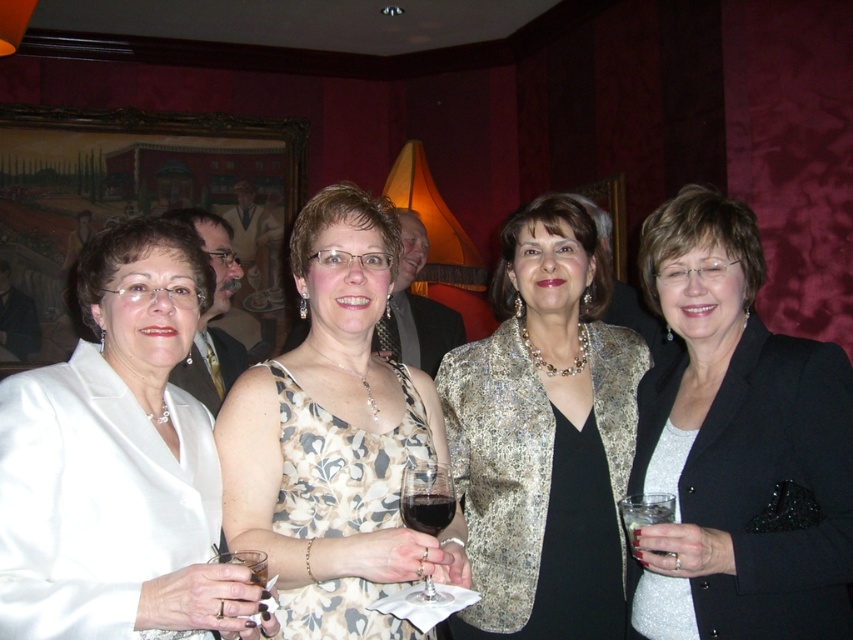
Which is in front, point (693, 296) or point (537, 548)?

Point (693, 296) is more forward.

Is black satin blazer at center below gold textured blazer at center?

No.

Describe the element at coordinates (738, 444) in the screenshot. I see `black satin blazer at center` at that location.

Locate an element on the screen. The height and width of the screenshot is (640, 853). black satin blazer at center is located at coordinates 738,444.

Is gold textured blazer at center behind clear glass wine glass at lower left?

Yes, gold textured blazer at center is behind clear glass wine glass at lower left.

Can you confirm if gold textured blazer at center is positioned to the right of clear glass wine glass at lower left?

Yes, gold textured blazer at center is to the right of clear glass wine glass at lower left.

In order to click on gold textured blazer at center in this screenshot , I will do point(544,435).

Does point (293, 538) come closer to viewer compared to point (440, 522)?

No, (293, 538) is further to viewer.

Does printed silk dress at center have a greater width compared to dark glass wine at center?

Yes, printed silk dress at center is wider than dark glass wine at center.

Who is more distant from viewer, [402,627] or [440,497]?

Positioned behind is point [402,627].

Identify the location of printed silk dress at center. (335, 436).